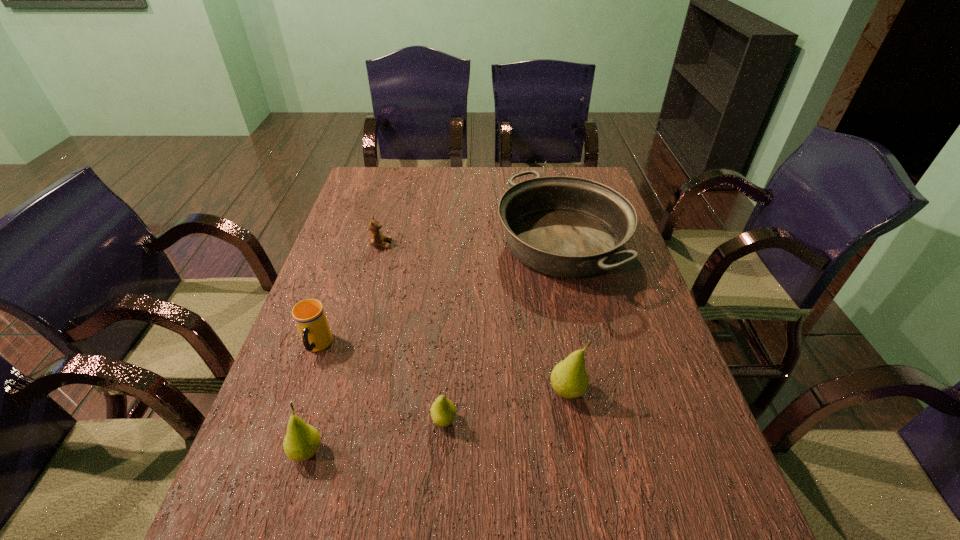
Select which pear is the closest to the fifth farthest object. Please provide its 2D coordinates. Your answer should be formatted as a tuple, i.e. [(x, y)], where the tuple contains the x and y coordinates of a point satisfying the conditions above.

[(569, 378)]

You are a GUI agent. You are given a task and a screenshot of the screen. Output one action in this format:
    pyautogui.click(x=<x>, y=<y>)
    Task: Click on the free space that satisfies the following two spatial constraints: 1. on the front-facing side of the pan; 2. on the right side of the shortest object
    The width and height of the screenshot is (960, 540).
    Given the screenshot: What is the action you would take?
    pyautogui.click(x=381, y=245)

Find the location of a particular element. This screenshot has height=540, width=960. vacant position in the image that satisfies the following two spatial constraints: 1. on the side of the cup with the handle; 2. on the left side of the nearest pear is located at coordinates (280, 453).

Locate an element on the screen. vacant space that satisfies the following two spatial constraints: 1. on the front-facing side of the teddy bear; 2. on the side of the third farthest object with the handle is located at coordinates click(354, 346).

Find the location of a particular element. Image resolution: width=960 pixels, height=540 pixels. vacant area in the image that satisfies the following two spatial constraints: 1. on the front-facing side of the pan; 2. on the right side of the shortest object is located at coordinates (381, 245).

Identify the location of vacant point that satisfies the following two spatial constraints: 1. on the front-facing side of the fourth farthest object; 2. on the left side of the teddy bear. The height and width of the screenshot is (540, 960). (342, 392).

Locate an element on the screen. free point that satisfies the following two spatial constraints: 1. on the front-facing side of the shortest object; 2. on the back side of the shortest pear is located at coordinates (334, 420).

Where is `free point that satisfies the following two spatial constraints: 1. on the front-facing side of the pan; 2. on the right side of the shortest object`? free point that satisfies the following two spatial constraints: 1. on the front-facing side of the pan; 2. on the right side of the shortest object is located at coordinates (381, 245).

What are the coordinates of `free location that satisfies the following two spatial constraints: 1. on the front-facing side of the rightmost pear; 2. on the left side of the teddy bear` in the screenshot? It's located at (342, 392).